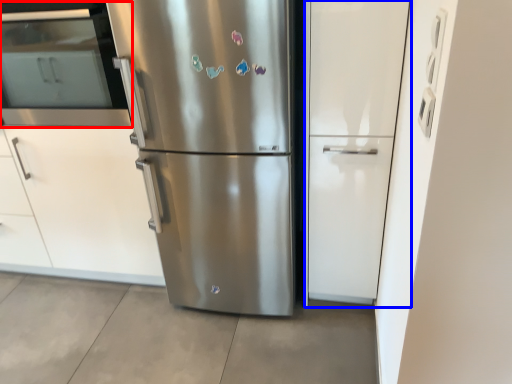
Question: Which object is further to the camera taking this photo, oven (highlighted by a red box) or glass door (highlighted by a blue box)?

Choices:
 (A) oven
 (B) glass door

Answer: (A)